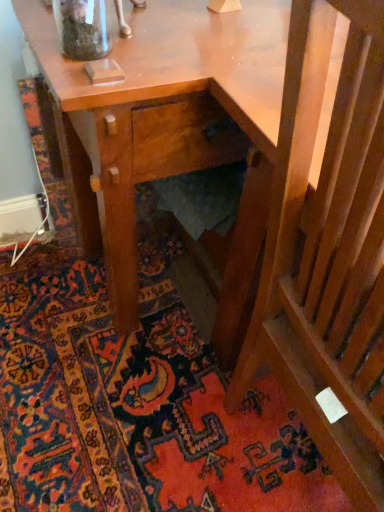
Locate an element on the screen. empty space that is ontop of carpeted stairs at lower right (from a real-world perspective) is located at coordinates (120, 371).